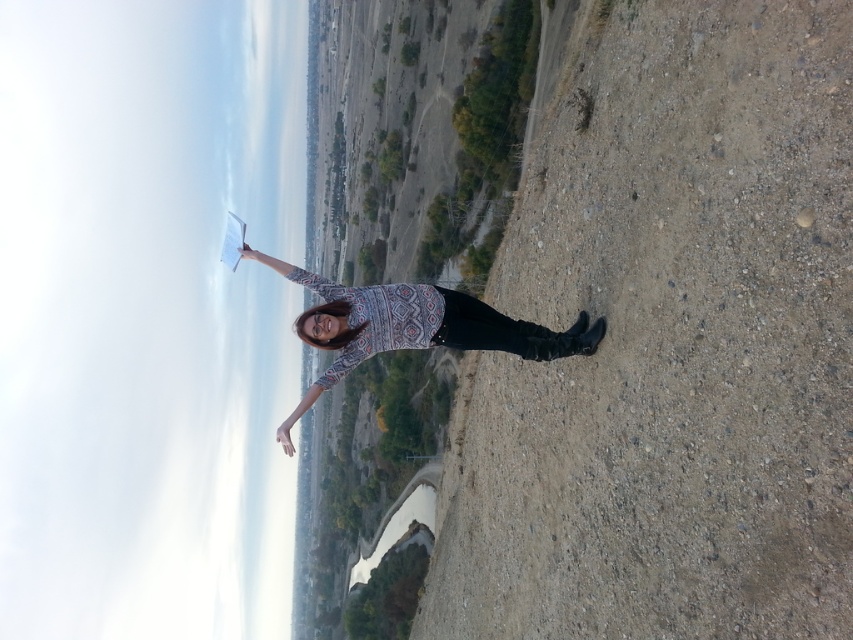
Is dirt ground at center bigger than patterned sweater at center?

Yes.

Is point (772, 349) positioned after point (320, 339)?

No, (772, 349) is closer to viewer.

Is point (711, 570) farther from camera compared to point (546, 342)?

No, (711, 570) is closer to viewer.

At what (x,y) coordinates should I click in order to perform the action: click on dirt ground at center. Please return your answer as a coordinate pair (x, y). Looking at the image, I should click on (671, 346).